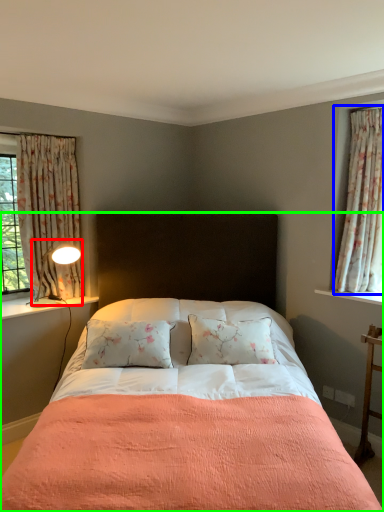
Question: Considering the real-world distances, which object is closest to light fixture (highlighted by a red box)? curtain (highlighted by a blue box) or bed (highlighted by a green box).

Choices:
 (A) curtain
 (B) bed

Answer: (B)